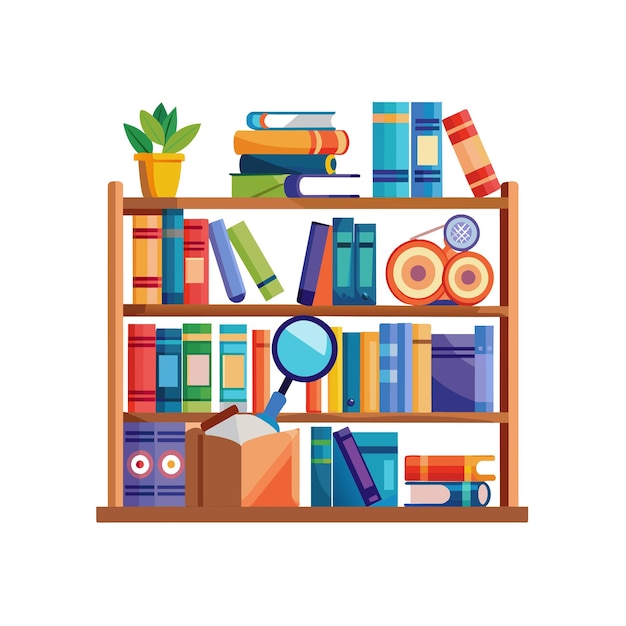
What are the coordinates of `book on fourth shelf from top (bottom shelf)` in the screenshot? It's located at (133, 459), (166, 458), (316, 478), (357, 473), (379, 471), (419, 469), (426, 493).